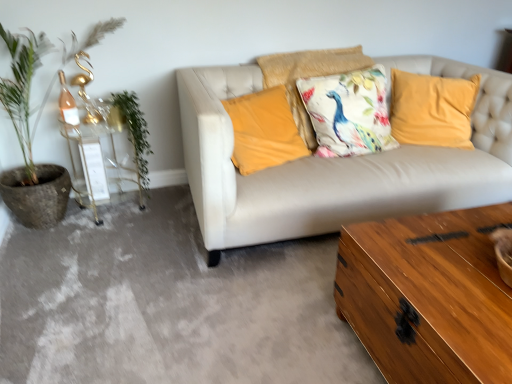
Question: Is shiny brown wooden trunk at lower right turned away from gold metallic table lamp at left?

Choices:
 (A) yes
 (B) no

Answer: (B)

Question: Can you confirm if shiny brown wooden trunk at lower right is positioned to the right of gold metallic table lamp at left?

Choices:
 (A) no
 (B) yes

Answer: (B)

Question: Considering the relative sizes of shiny brown wooden trunk at lower right and gold metallic table lamp at left in the image provided, is shiny brown wooden trunk at lower right taller than gold metallic table lamp at left?

Choices:
 (A) no
 (B) yes

Answer: (B)

Question: Is shiny brown wooden trunk at lower right further to the viewer compared to gold metallic table lamp at left?

Choices:
 (A) yes
 (B) no

Answer: (B)

Question: Is shiny brown wooden trunk at lower right positioned in front of gold metallic table lamp at left?

Choices:
 (A) no
 (B) yes

Answer: (B)

Question: Considering the relative sizes of shiny brown wooden trunk at lower right and gold metallic table lamp at left in the image provided, is shiny brown wooden trunk at lower right shorter than gold metallic table lamp at left?

Choices:
 (A) yes
 (B) no

Answer: (B)

Question: Does wooden chest at lower right have a larger size compared to floral cotton cushion at center, which ranks as the 3th pillow in left-to-right order?

Choices:
 (A) yes
 (B) no

Answer: (B)

Question: Are wooden chest at lower right and floral cotton cushion at center, which ranks as the 3th pillow in left-to-right order, located far from each other?

Choices:
 (A) no
 (B) yes

Answer: (A)

Question: Does wooden chest at lower right turn towards floral cotton cushion at center, marked as the 1th pillow in a right-to-left arrangement?

Choices:
 (A) no
 (B) yes

Answer: (A)

Question: Is wooden chest at lower right closer to camera compared to floral cotton cushion at center, marked as the 1th pillow in a right-to-left arrangement?

Choices:
 (A) yes
 (B) no

Answer: (A)

Question: From the image's perspective, is wooden chest at lower right under floral cotton cushion at center, marked as the 1th pillow in a right-to-left arrangement?

Choices:
 (A) no
 (B) yes

Answer: (B)

Question: Does wooden chest at lower right have a lesser height compared to floral cotton cushion at center, marked as the 1th pillow in a right-to-left arrangement?

Choices:
 (A) yes
 (B) no

Answer: (A)

Question: Can you confirm if floral cotton cushion at center, marked as the 1th pillow in a right-to-left arrangement, is bigger than velvet yellow pillow at center, placed as the 1th pillow when sorted from left to right?

Choices:
 (A) no
 (B) yes

Answer: (B)